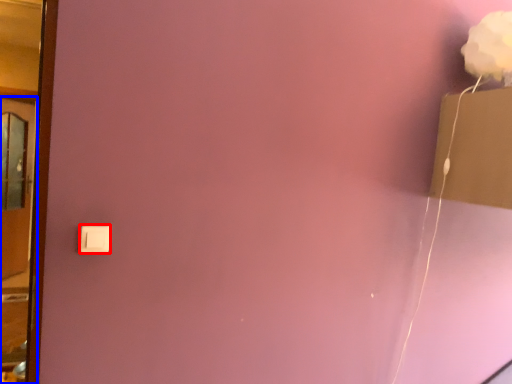
Question: Which object appears closest to the camera in this image, light switch (highlighted by a red box) or door (highlighted by a blue box)?

Choices:
 (A) light switch
 (B) door

Answer: (B)